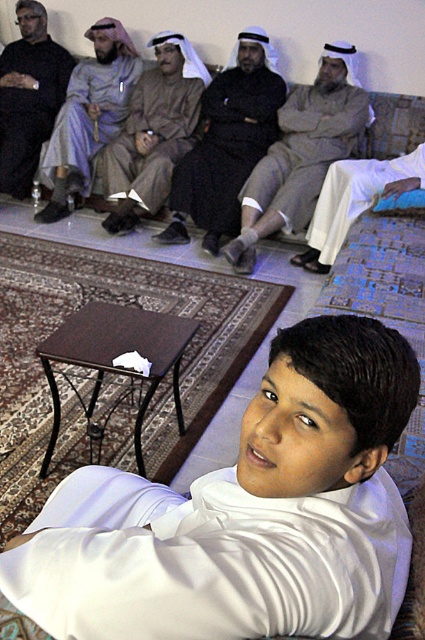
You are a tailor who needs to determine which robe requires more fabric to make between the matte brown robe at center and the light gray fabric robe at center. Based on the scene description, which robe would need more fabric?

The matte brown robe at center requires more fabric because its width is larger than the light gray fabric robe at center.

You are standing in the room and want to move from point (x=207, y=90) to point (x=91, y=148). Which direction should you move to get closer to the background of the scene?

You should move towards point (x=91, y=148) because it is farther from the viewer compared to point (x=207, y=90), which is closer to the foreground.